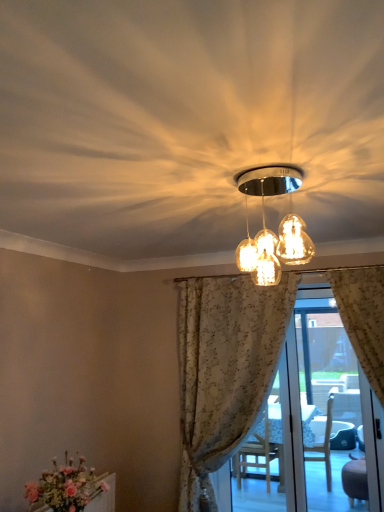
Question: Is translucent floral curtains at center thinner than matte glass light fixture at center?

Choices:
 (A) no
 (B) yes

Answer: (B)

Question: Is translucent floral curtains at center turned away from matte glass light fixture at center?

Choices:
 (A) yes
 (B) no

Answer: (B)

Question: Is translucent floral curtains at center to the right of matte glass light fixture at center from the viewer's perspective?

Choices:
 (A) no
 (B) yes

Answer: (B)

Question: From a real-world perspective, is translucent floral curtains at center physically above matte glass light fixture at center?

Choices:
 (A) no
 (B) yes

Answer: (A)

Question: From the image's perspective, is translucent floral curtains at center located beneath matte glass light fixture at center?

Choices:
 (A) no
 (B) yes

Answer: (B)

Question: From a real-world perspective, relative to translucent floral curtains at center, is matte pink flowers at lower left vertically above or below?

Choices:
 (A) below
 (B) above

Answer: (A)

Question: Considering the positions of matte pink flowers at lower left and translucent floral curtains at center in the image, is matte pink flowers at lower left wider or thinner than translucent floral curtains at center?

Choices:
 (A) thin
 (B) wide

Answer: (B)

Question: Looking at the image, does matte pink flowers at lower left seem bigger or smaller compared to translucent floral curtains at center?

Choices:
 (A) big
 (B) small

Answer: (B)

Question: In terms of height, does matte pink flowers at lower left look taller or shorter compared to translucent floral curtains at center?

Choices:
 (A) tall
 (B) short

Answer: (B)

Question: From a real-world perspective, is translucent floral curtains at center above or below floral fabric curtain at center?

Choices:
 (A) below
 (B) above

Answer: (A)

Question: Visually, is translucent floral curtains at center positioned to the left or to the right of floral fabric curtain at center?

Choices:
 (A) left
 (B) right

Answer: (B)

Question: Is translucent floral curtains at center bigger or smaller than floral fabric curtain at center?

Choices:
 (A) small
 (B) big

Answer: (A)

Question: Considering the positions of translucent floral curtains at center and floral fabric curtain at center in the image, is translucent floral curtains at center wider or thinner than floral fabric curtain at center?

Choices:
 (A) thin
 (B) wide

Answer: (A)

Question: Considering the positions of point (279, 245) and point (304, 332), is point (279, 245) closer or farther from the camera than point (304, 332)?

Choices:
 (A) farther
 (B) closer

Answer: (B)

Question: Looking at their shapes, would you say matte glass light fixture at center is wider or thinner than translucent floral curtains at center?

Choices:
 (A) wide
 (B) thin

Answer: (A)